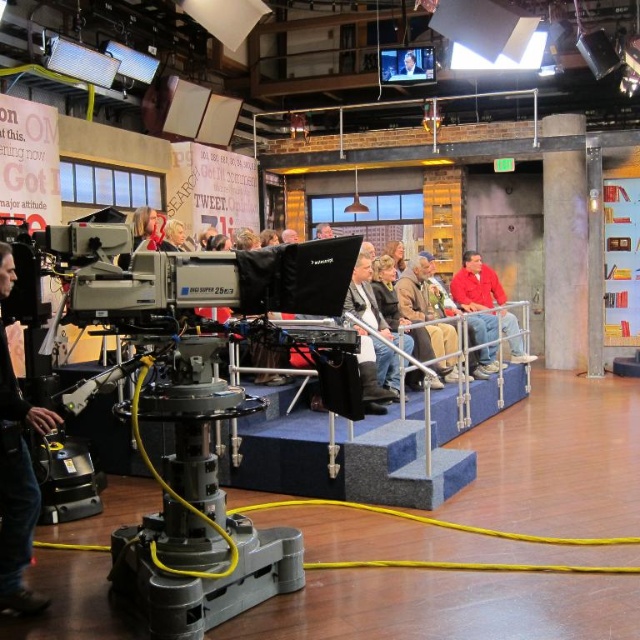
You are a stagehand in the studio and need to move a heavy equipment from the camera to the audience seating. The camera is located at point (1,464) and the audience seating is at point (516,356). Which direction should you move the equipment to reach the audience seating from the camera?

To move from the camera at point (1,464) to the audience seating at point (516,356), you should move backward since point (1,464) is in front of point (516,356).

You are a camera operator in the studio. You need to adjust the camera to focus on two specific points marked on the floor. The first point is point (x=140, y=234) and the second is point (x=412, y=74). Which point should you focus on first if you want to follow the natural viewing path from the audience perspective?

You should focus on point (x=140, y=234) first because it is in front of point (x=412, y=74) from the audience perspective.

You are a camera operator adjusting the focus on the camera. You notice two subjects in your viewfinder, the blonde hair at center and the smooth skin face at upper center. Which subject should you focus on to ensure the other is also in focus?

Since the blonde hair at center is in front of the smooth skin face at upper center, focusing on the blonde hair at center will keep the smooth skin face at upper center in focus as well.